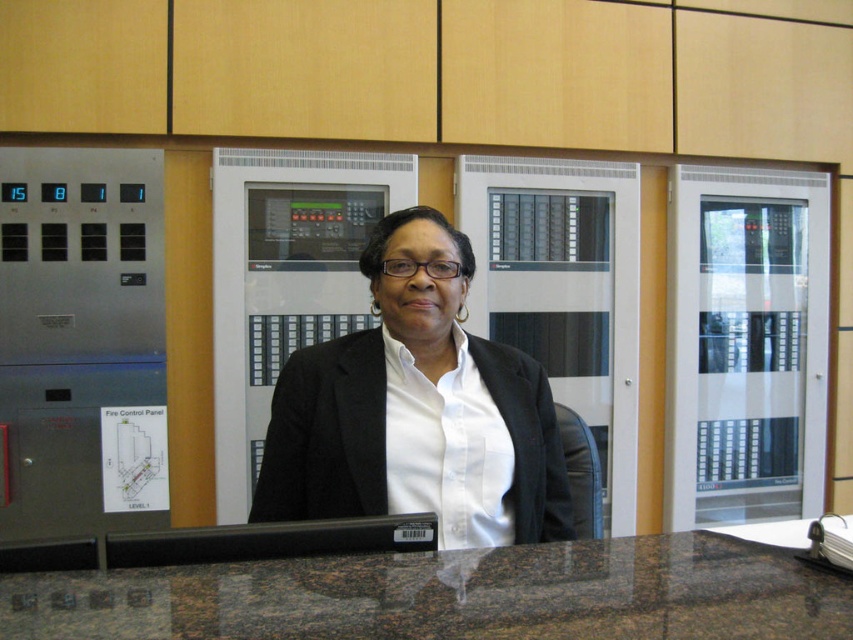
Question: Is brown granite table at center closer to the viewer compared to white matte blazer at center?

Choices:
 (A) no
 (B) yes

Answer: (B)

Question: Is brown granite table at center smaller than white matte blazer at center?

Choices:
 (A) yes
 (B) no

Answer: (A)

Question: Which point is closer to the camera taking this photo?

Choices:
 (A) (734, 604)
 (B) (399, 352)

Answer: (A)

Question: Is brown granite table at center above white matte blazer at center?

Choices:
 (A) no
 (B) yes

Answer: (A)

Question: Which point is closer to the camera?

Choices:
 (A) white matte blazer at center
 (B) brown granite table at center

Answer: (B)

Question: Which point is closer to the camera?

Choices:
 (A) (55, 612)
 (B) (285, 419)

Answer: (A)